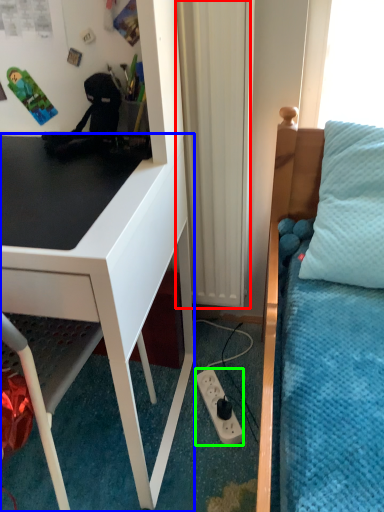
Question: Estimate the real-world distances between objects in this image. Which object is farther from curtain (highlighted by a red box), desk (highlighted by a blue box) or power outlet (highlighted by a green box)?

Choices:
 (A) desk
 (B) power outlet

Answer: (B)